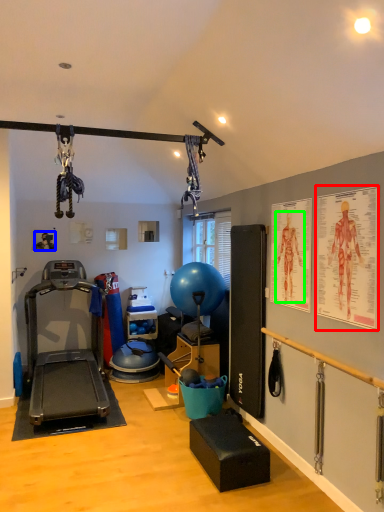
Question: Which is nearer to the poster page (highlighted by a red box)? person (highlighted by a blue box) or person (highlighted by a green box).

Choices:
 (A) person
 (B) person

Answer: (B)